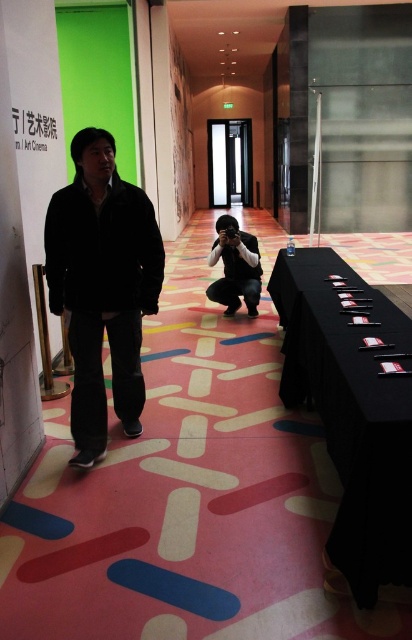
Question: Which point is farther from the camera taking this photo?

Choices:
 (A) (278, 285)
 (B) (81, 182)
 (C) (219, 256)

Answer: (C)

Question: Is black fabric table at lower right smaller than matte black camera at center?

Choices:
 (A) yes
 (B) no

Answer: (B)

Question: Which point is closer to the camera taking this photo?

Choices:
 (A) (255, 301)
 (B) (325, 323)
 (C) (88, 289)

Answer: (C)

Question: Which of the following is the closest to the observer?

Choices:
 (A) pyautogui.click(x=295, y=401)
 (B) pyautogui.click(x=77, y=416)

Answer: (B)

Question: Does black fabric table at lower right have a lesser width compared to dark matte jacket at center?

Choices:
 (A) yes
 (B) no

Answer: (A)

Question: Can you confirm if black fabric table at lower right is positioned below dark matte jacket at center?

Choices:
 (A) no
 (B) yes

Answer: (B)